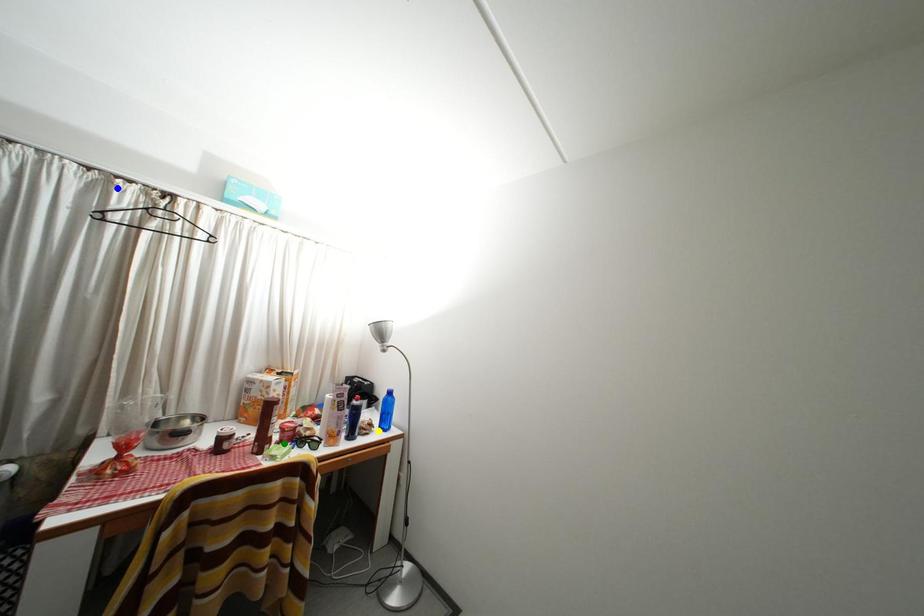
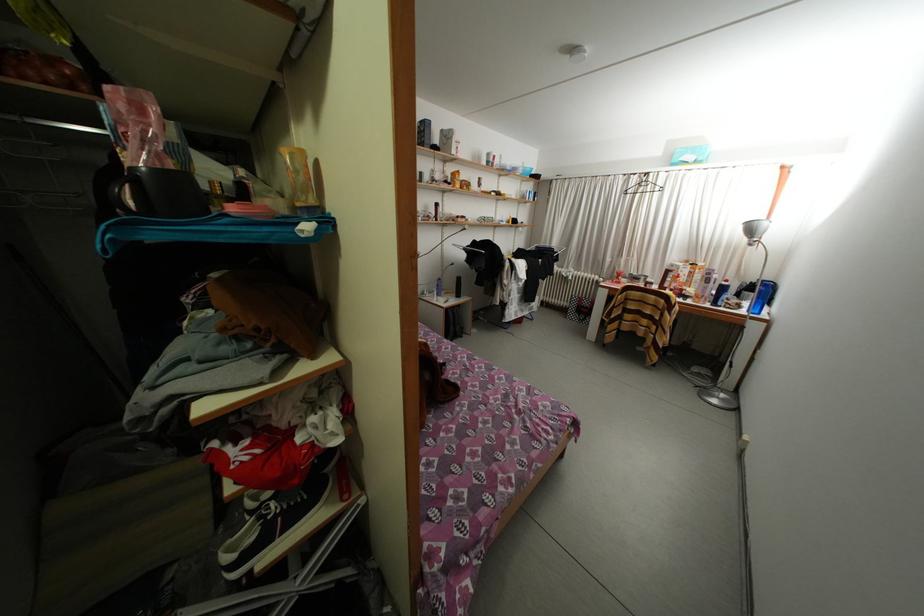
I am providing you with two images of the same scene from different viewpoints. Three points are marked in image1. Which point corresponds to a part or object that is occluded in image2?In image1, three points are marked. Which of them correspond to a part or object that is occluded in image2?Among the three points shown in image1, which one corresponds to a part or object that is no longer visible due to occlusion in image2?

green point cannot be seen in image2.